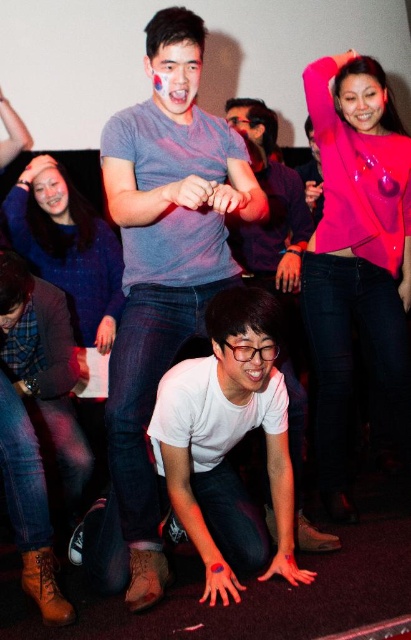
Who is taller, gray cotton t-shirt at center or white matte t-shirt at lower center?

gray cotton t-shirt at center is taller.

Can you confirm if gray cotton t-shirt at center is positioned below white matte t-shirt at lower center?

Indeed, gray cotton t-shirt at center is positioned under white matte t-shirt at lower center.

What do you see at coordinates (164, 259) in the screenshot? This screenshot has width=411, height=640. I see `gray cotton t-shirt at center` at bounding box center [164, 259].

Where is `gray cotton t-shirt at center`? The image size is (411, 640). gray cotton t-shirt at center is located at coordinates (164, 259).

Does point (200, 154) lie behind point (276, 440)?

No, it is not.

Which is more to the left, gray cotton t-shirt at center or white matte shirt at center?

From the viewer's perspective, gray cotton t-shirt at center appears more on the left side.

Identify the location of gray cotton t-shirt at center. (164, 259).

Where is `gray cotton t-shirt at center`? Image resolution: width=411 pixels, height=640 pixels. gray cotton t-shirt at center is located at coordinates (164, 259).

Is white matte shirt at center below white matte t-shirt at lower center?

Correct, white matte shirt at center is located below white matte t-shirt at lower center.

Who is positioned more to the right, white matte shirt at center or white matte t-shirt at lower center?

From the viewer's perspective, white matte t-shirt at lower center appears more on the right side.

Is point (212, 371) closer to viewer compared to point (258, 108)?

Yes, it is.

The width and height of the screenshot is (411, 640). I want to click on white matte shirt at center, so click(x=228, y=428).